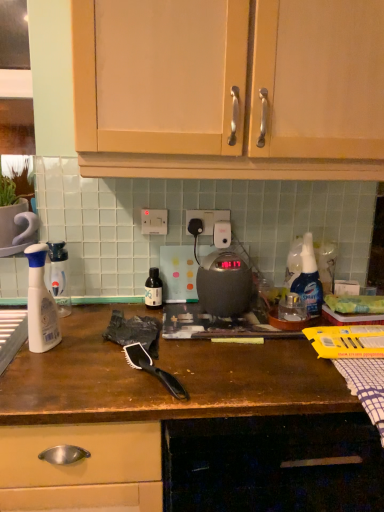
I want to click on unoccupied space behind translucent plastic spray bottle at left, so click(75, 323).